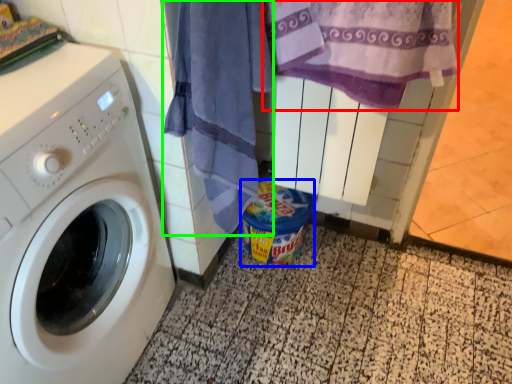
Question: Based on their relative distances, which object is farther from beach towel (highlighted by a red box)? Choose from garbage (highlighted by a blue box) and beach towel (highlighted by a green box).

Choices:
 (A) garbage
 (B) beach towel

Answer: (A)